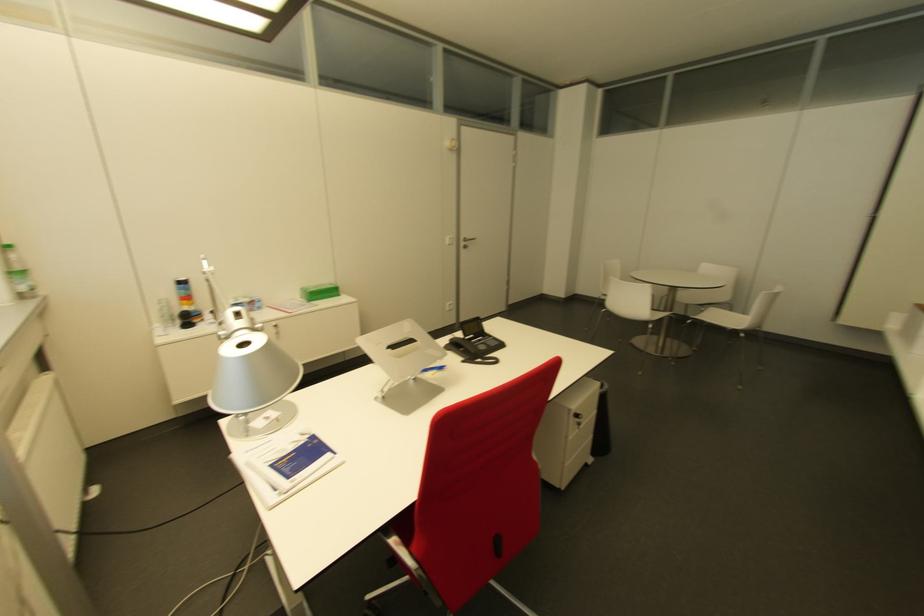
Identify the location of silver lamp head. The image size is (924, 616). (253, 384).